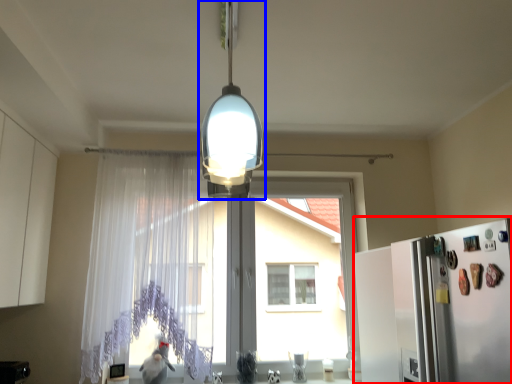
Question: Which of the following is the closest to the observer, fridge (highlighted by a red box) or lamp (highlighted by a blue box)?

Choices:
 (A) fridge
 (B) lamp

Answer: (B)